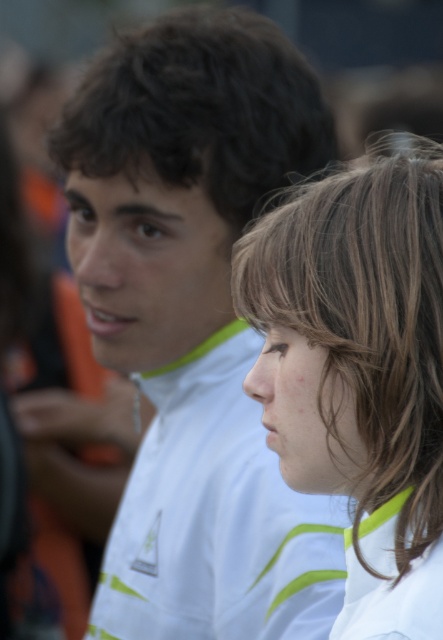
Can you confirm if brown smooth hair at center is smaller than dark brown curly hair at upper center?

Yes.

From the picture: Who is more distant from viewer, (x=313, y=275) or (x=128, y=177)?

Point (x=128, y=177)

Where is `brown smooth hair at center`? The width and height of the screenshot is (443, 640). brown smooth hair at center is located at coordinates (362, 332).

Is white matte jacket at center behind dark brown curly hair at upper center?

No, white matte jacket at center is closer to the viewer.

Is white matte jacket at center closer to the viewer compared to dark brown curly hair at upper center?

Yes, white matte jacket at center is closer to the viewer.

Which is behind, point (112, 106) or point (260, 134)?

Positioned behind is point (260, 134).

Locate an element on the screen. The height and width of the screenshot is (640, 443). white matte jacket at center is located at coordinates (195, 323).

Can you confirm if white matte jacket at center is wider than white matte shirt at center?

Yes.

Is white matte jacket at center behind white matte shirt at center?

Yes, white matte jacket at center is further from the viewer.

Is point (177, 547) positioned behind point (255, 467)?

Yes, point (177, 547) is farther from viewer.

You are a GUI agent. You are given a task and a screenshot of the screen. Output one action in this format:
    pyautogui.click(x=<x>, y=<y>)
    Task: Click on the white matte jacket at center
    The width and height of the screenshot is (443, 640).
    Given the screenshot: What is the action you would take?
    pyautogui.click(x=195, y=323)